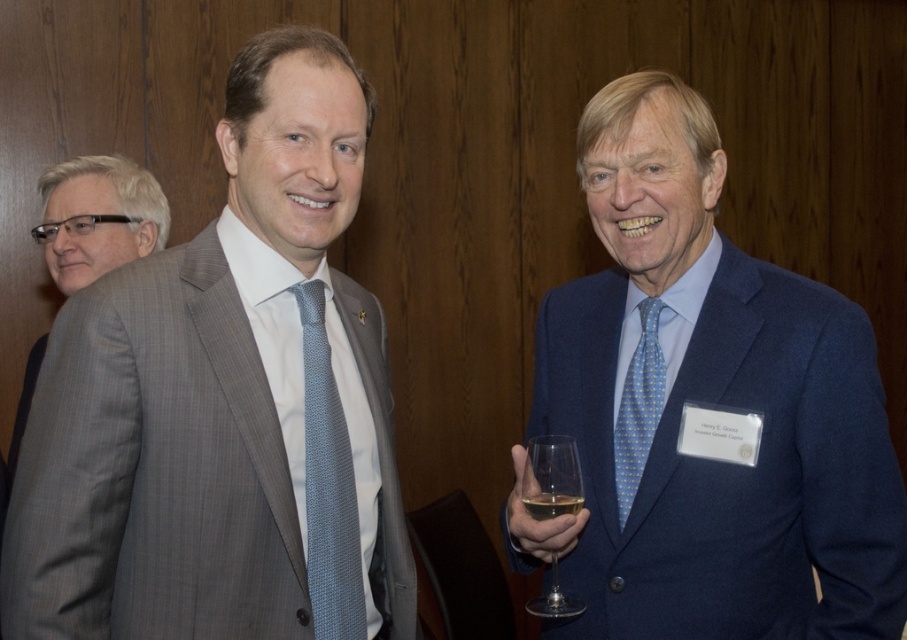
You are a photographer at the event and want to capture a closeup of the blue dotted silk tie at right and the translucent glass at center. Which object will appear wider in the photo?

The translucent glass at center will appear wider in the photo since it is thicker than the blue dotted silk tie at right.